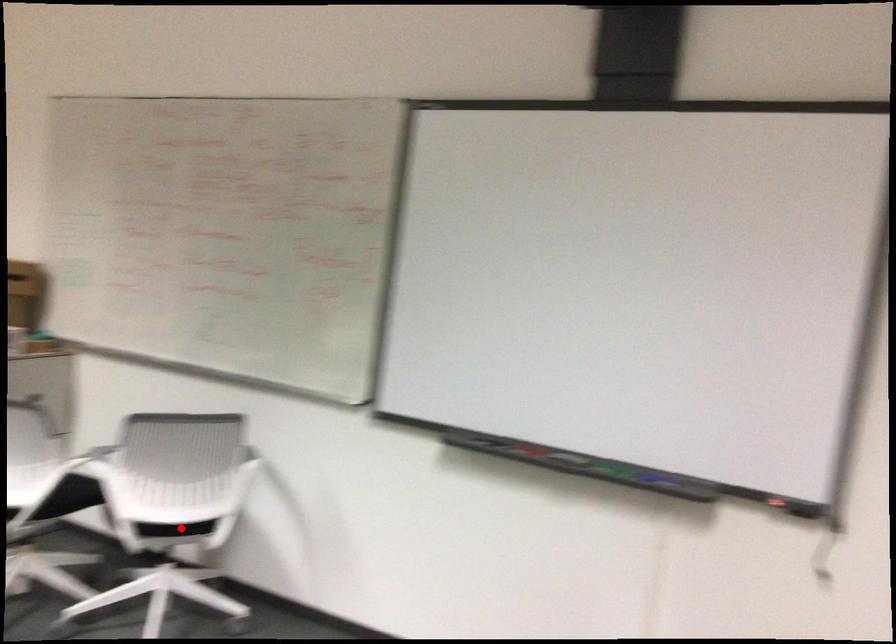
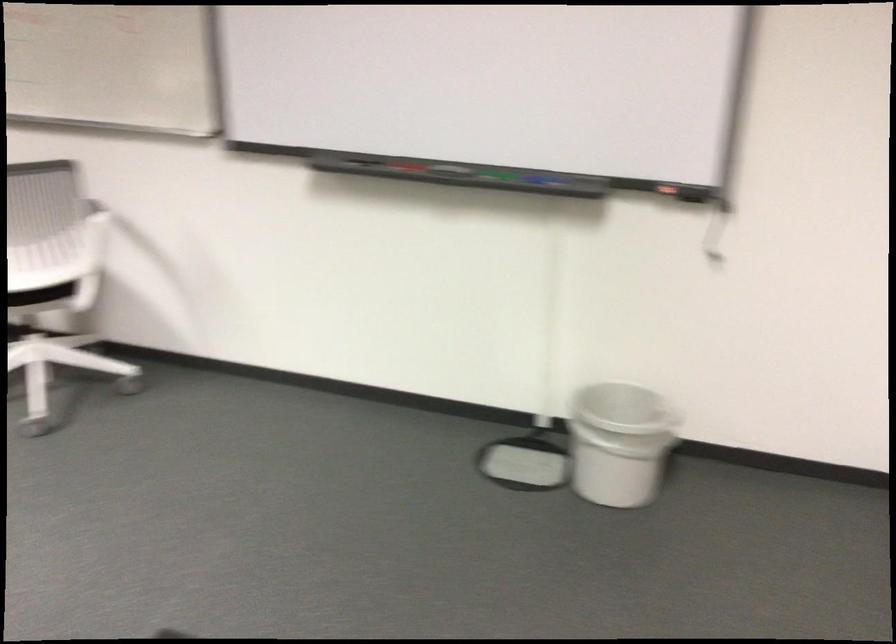
In the second image, find the point that corresponds to the highlighted location in the first image.

(40, 295)